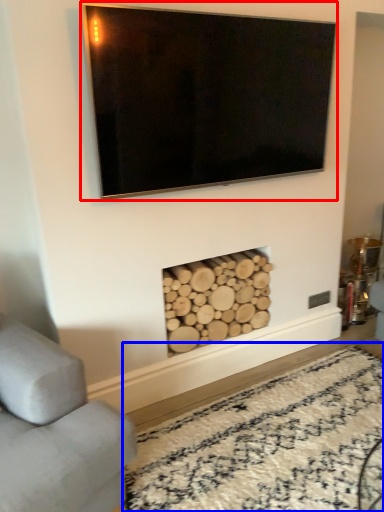
Question: Which of the following is the farthest to the observer, television (highlighted by a red box) or plain (highlighted by a blue box)?

Choices:
 (A) television
 (B) plain

Answer: (A)